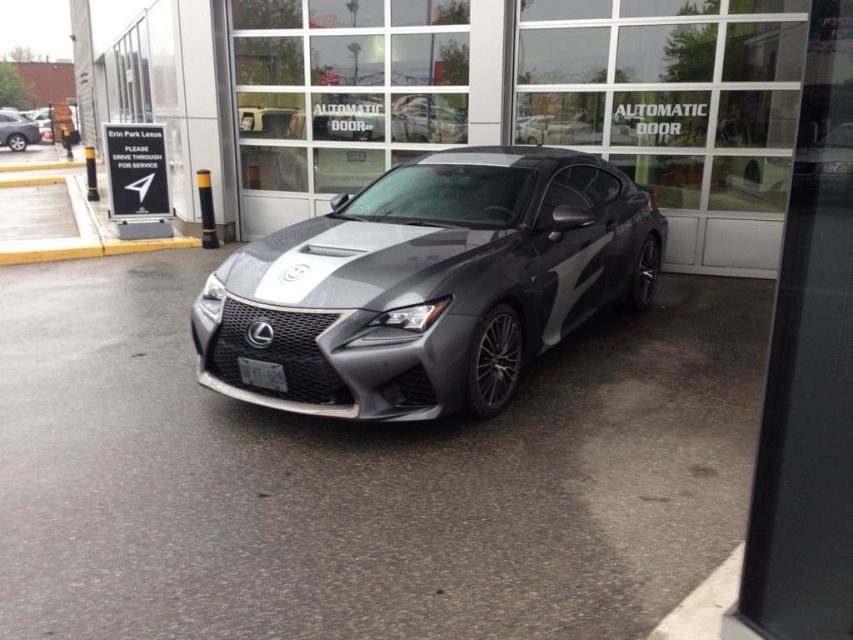
Question: Does glossy metallic car at center appear over matte black car at left?

Choices:
 (A) no
 (B) yes

Answer: (A)

Question: Among these points, which one is farthest from the camera?

Choices:
 (A) (16, 132)
 (B) (801, 56)

Answer: (A)

Question: Where is glossy metallic car at center located in relation to matte black car at left in the image?

Choices:
 (A) left
 (B) right

Answer: (B)

Question: Which of these objects is positioned farthest from the matte black car at left?

Choices:
 (A) glossy metallic car at center
 (B) satin metallic sedan at center

Answer: (B)

Question: In this image, where is glossy metallic car at center located relative to satin metallic sedan at center?

Choices:
 (A) above
 (B) below

Answer: (A)

Question: Which point is closer to the camera taking this photo?

Choices:
 (A) click(x=33, y=124)
 (B) click(x=207, y=154)

Answer: (B)